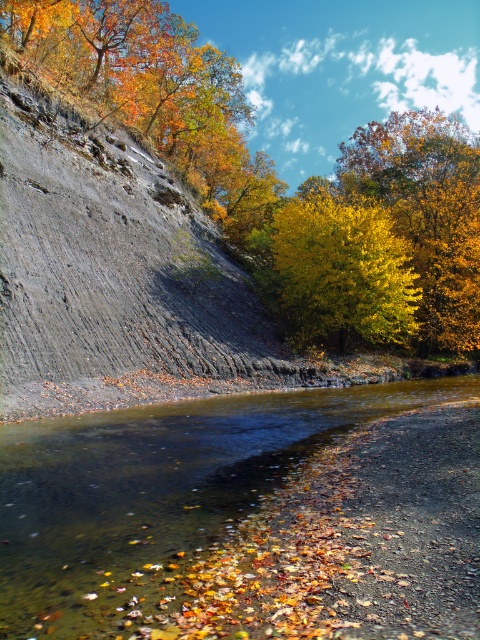
Question: Can you confirm if yellow/golden leaves at upper right is bigger than yellow leafy tree at center?

Choices:
 (A) no
 (B) yes

Answer: (B)

Question: Which point appears farthest from the camera in this image?

Choices:
 (A) (310, 275)
 (B) (123, 586)

Answer: (A)

Question: Estimate the real-world distances between objects in this image. Which object is farther from the golden yellow leaves at upper center?

Choices:
 (A) yellow/golden leaves at upper right
 (B) brown sedimentary rock at lower center
 (C) yellow leafy tree at center

Answer: (B)

Question: Can you confirm if brown sedimentary rock at lower center is thinner than yellow leafy tree at center?

Choices:
 (A) yes
 (B) no

Answer: (A)

Question: Based on their relative distances, which object is nearer to the yellow/golden leaves at upper right?

Choices:
 (A) yellow leafy tree at center
 (B) golden yellow leaves at upper center
 (C) brown sedimentary rock at lower center

Answer: (B)

Question: Is brown sedimentary rock at lower center to the left of yellow leafy tree at center from the viewer's perspective?

Choices:
 (A) yes
 (B) no

Answer: (A)